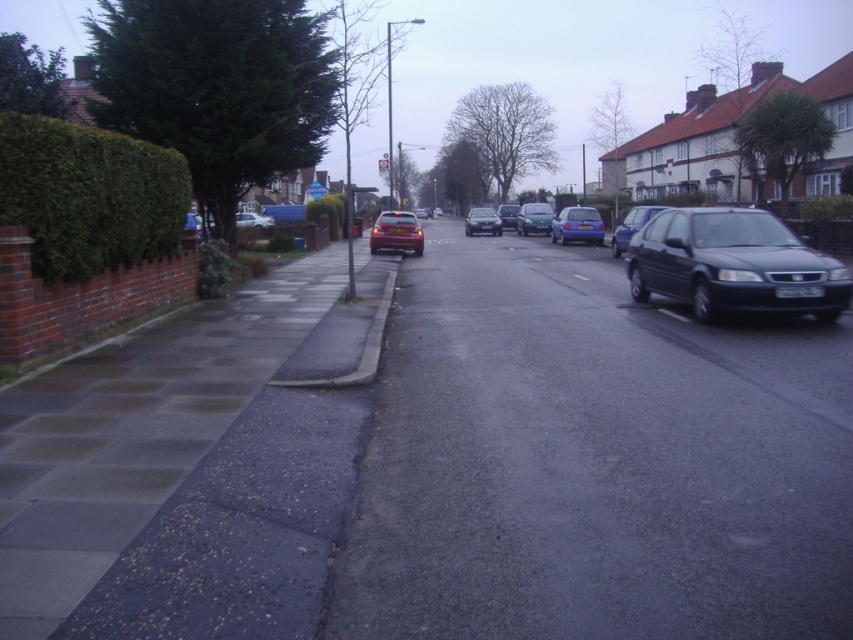
Question: Is paved concrete sidewalk at lower left above matte silver car at center?

Choices:
 (A) yes
 (B) no

Answer: (B)

Question: Considering the relative positions of shiny metallic car at center and matte black car at right in the image provided, where is shiny metallic car at center located with respect to matte black car at right?

Choices:
 (A) left
 (B) right

Answer: (A)

Question: Which point is farther to the camera?

Choices:
 (A) (624, 604)
 (B) (141, 513)
 (C) (254, 212)

Answer: (C)

Question: Does blue metallic sedan at center have a greater width compared to matte silver car at center?

Choices:
 (A) yes
 (B) no

Answer: (B)

Question: Which point appears farthest from the camera in this image?

Choices:
 (A) (544, 220)
 (B) (515, 227)
 (C) (708, 298)
 (D) (375, 348)

Answer: (B)

Question: Which point appears closest to the camera in this image?

Choices:
 (A) (479, 230)
 (B) (619, 230)
 (C) (577, 608)

Answer: (C)